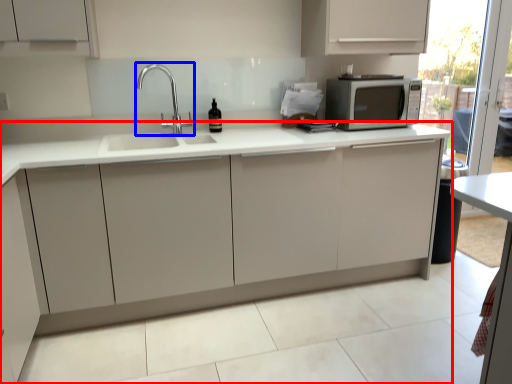
Question: Which object appears farthest to the camera in this image, cabinetry (highlighted by a red box) or tap (highlighted by a blue box)?

Choices:
 (A) cabinetry
 (B) tap

Answer: (B)